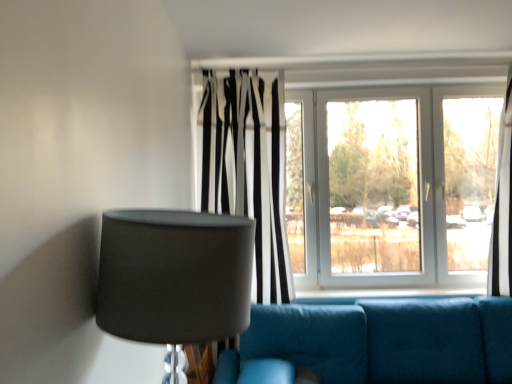
Image resolution: width=512 pixels, height=384 pixels. What are the coordinates of `black and white striped curtain at center` in the screenshot? It's located at (248, 167).

The width and height of the screenshot is (512, 384). Describe the element at coordinates (383, 341) in the screenshot. I see `teal fabric couch at lower center` at that location.

This screenshot has height=384, width=512. What do you see at coordinates (174, 277) in the screenshot? I see `matte gray lampshade at left` at bounding box center [174, 277].

Locate an element on the screen. black and white striped curtain at center is located at coordinates (248, 167).

Is matte gray lampshade at left inside teal fabric couch at lower center?

Actually, matte gray lampshade at left is outside teal fabric couch at lower center.

Would you say teal fabric couch at lower center is to the left or to the right of matte gray lampshade at left in the picture?

teal fabric couch at lower center is positioned on matte gray lampshade at left's right side.

From the image's perspective, which one is positioned lower, teal fabric couch at lower center or matte gray lampshade at left?

teal fabric couch at lower center appears lower in the image.

Does point (489, 96) appear closer or farther from the camera than point (210, 326)?

Point (489, 96) is farther from the camera than point (210, 326).

From a real-world perspective, between white glossy window at center and matte gray lampshade at left, who is vertically lower?

matte gray lampshade at left is physically lower.

In the scene shown: Is white glossy window at center oriented towards matte gray lampshade at left?

Yes, white glossy window at center is oriented towards matte gray lampshade at left.

Where is `studio couch in front of the white glossy window at center`? This screenshot has width=512, height=384. studio couch in front of the white glossy window at center is located at coordinates (383, 341).

From the image's perspective, is teal fabric couch at lower center positioned above or below white glossy window at center?

teal fabric couch at lower center is situated lower than white glossy window at center in the image.

Does teal fabric couch at lower center contain white glossy window at center?

Definitely not — white glossy window at center is not inside teal fabric couch at lower center.

From a real-world perspective, between black and white striped curtain at center and matte gray lampshade at left, who is vertically lower?

From a 3D spatial view, matte gray lampshade at left is below.

From the image's perspective, does black and white striped curtain at center appear higher than matte gray lampshade at left?

Yes, from the image's perspective, black and white striped curtain at center is over matte gray lampshade at left.

Between black and white striped curtain at center and matte gray lampshade at left, which one is positioned in front?

matte gray lampshade at left is closer to the camera.

How different are the orientations of black and white striped curtain at center and matte gray lampshade at left in degrees?

black and white striped curtain at center and matte gray lampshade at left are facing 90.4 degrees away from each other.

Would you consider black and white striped curtain at center to be distant from white glossy window at center?

Actually, black and white striped curtain at center and white glossy window at center are a little close together.

Is black and white striped curtain at center at the left side of white glossy window at center?

Indeed, black and white striped curtain at center is positioned on the left side of white glossy window at center.

Does point (267, 212) come in front of point (280, 119)?

Yes, point (267, 212) is in front of point (280, 119).

From the picture: Considering the relative sizes of matte gray lampshade at left and teal fabric couch at lower center in the image provided, is matte gray lampshade at left thinner than teal fabric couch at lower center?

Yes, matte gray lampshade at left is thinner than teal fabric couch at lower center.

Would you say matte gray lampshade at left contains teal fabric couch at lower center?

Actually, teal fabric couch at lower center is outside matte gray lampshade at left.

Which is in front, point (193, 330) or point (386, 354)?

The point (193, 330) is closer to the camera.

Does matte gray lampshade at left come in front of teal fabric couch at lower center?

Yes, it is.

Based on the photo, is the depth of matte gray lampshade at left greater than that of black and white striped curtain at center?

No, the depth of matte gray lampshade at left is less than that of black and white striped curtain at center.

From the image's perspective, is matte gray lampshade at left under black and white striped curtain at center?

Yes, from the image's perspective, matte gray lampshade at left is below black and white striped curtain at center.

The height and width of the screenshot is (384, 512). What are the coordinates of `curtain above the matte gray lampshade at left (from a real-world perspective)` in the screenshot? It's located at (248, 167).

Could you tell me if matte gray lampshade at left is turned towards black and white striped curtain at center?

No, matte gray lampshade at left is not oriented towards black and white striped curtain at center.

Image resolution: width=512 pixels, height=384 pixels. I want to click on studio couch behind the matte gray lampshade at left, so click(x=383, y=341).

Locate an element on the screen. The image size is (512, 384). window on the right of matte gray lampshade at left is located at coordinates (365, 171).

Looking at the image, which one is located closer to teal fabric couch at lower center, white glossy window at center or black and white striped curtain at center?

black and white striped curtain at center is positioned closer to the anchor teal fabric couch at lower center.

Which object lies nearer to the anchor point white glossy window at center, black and white striped curtain at center or matte gray lampshade at left?

black and white striped curtain at center.

From the image, which object appears to be nearer to white glossy window at center, black and white striped curtain at center or teal fabric couch at lower center?

black and white striped curtain at center is positioned closer to the anchor white glossy window at center.

Which object lies nearer to the anchor point white glossy window at center, matte gray lampshade at left or teal fabric couch at lower center?

Among the two, teal fabric couch at lower center is located nearer to white glossy window at center.

In the scene shown: From the image, which object appears to be nearer to black and white striped curtain at center, white glossy window at center or matte gray lampshade at left?

white glossy window at center is closer to black and white striped curtain at center.

Which object lies nearer to the anchor point teal fabric couch at lower center, matte gray lampshade at left or black and white striped curtain at center?

Among the two, black and white striped curtain at center is located nearer to teal fabric couch at lower center.

When comparing their distances from white glossy window at center, does matte gray lampshade at left or black and white striped curtain at center seem further?

matte gray lampshade at left is further to white glossy window at center.

Which object lies nearer to the anchor point black and white striped curtain at center, matte gray lampshade at left or teal fabric couch at lower center?

teal fabric couch at lower center is positioned closer to the anchor black and white striped curtain at center.

Locate an element on the screen. This screenshot has width=512, height=384. studio couch between matte gray lampshade at left and black and white striped curtain at center along the z-axis is located at coordinates (383, 341).

Locate an element on the screen. curtain between matte gray lampshade at left and white glossy window at center from front to back is located at coordinates (248, 167).

Locate an element on the screen. curtain positioned between teal fabric couch at lower center and white glossy window at center from near to far is located at coordinates coord(248,167).

The height and width of the screenshot is (384, 512). Find the location of `studio couch between matte gray lampshade at left and white glossy window at center along the z-axis`. studio couch between matte gray lampshade at left and white glossy window at center along the z-axis is located at coordinates (383, 341).